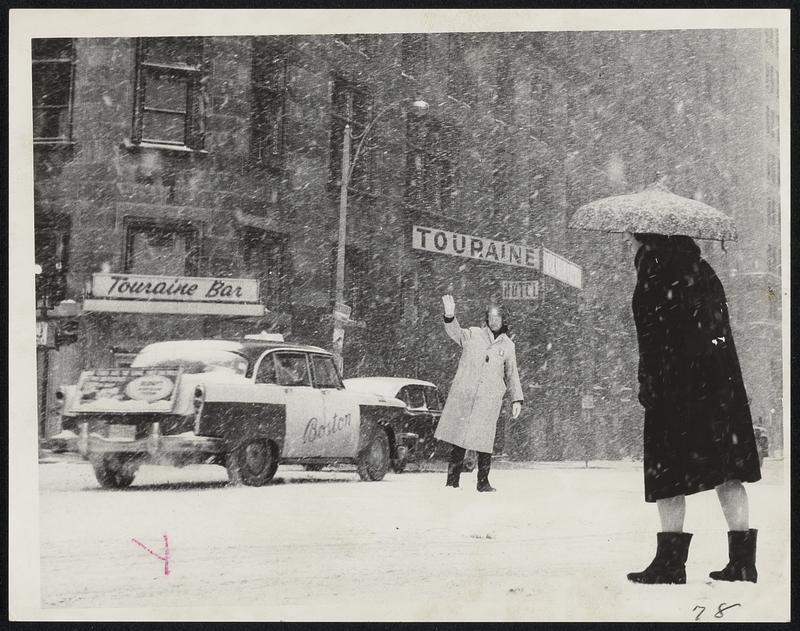
Locate an element on the screen. This screenshot has width=800, height=631. window is located at coordinates (162, 88).